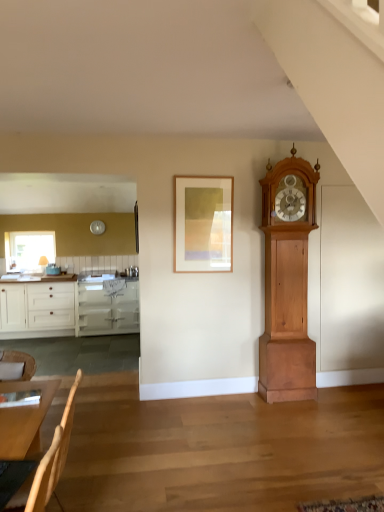
What do you see at coordinates (24, 420) in the screenshot? I see `light brown wooden table at lower left` at bounding box center [24, 420].

Find the location of a particular element. The image size is (384, 512). light brown wooden grandfather clock at right is located at coordinates (287, 282).

Considering the sizes of objects white glossy cabinetry at left and matte glass window at left in the image provided, who is smaller, white glossy cabinetry at left or matte glass window at left?

matte glass window at left.

How different are the orientations of white glossy cabinetry at left and matte glass window at left in degrees?

The angle between the facing direction of white glossy cabinetry at left and the facing direction of matte glass window at left is 0.483 degrees.

Is there a large distance between white glossy cabinetry at left and matte glass window at left?

Actually, white glossy cabinetry at left and matte glass window at left are a little close together.

From the image's perspective, which object appears higher, white glossy cabinetry at left or light brown wooden table at lower left?

light brown wooden table at lower left appears higher in the image.

How many degrees apart are the facing directions of white glossy cabinetry at left and light brown wooden table at lower left?

The facing directions of white glossy cabinetry at left and light brown wooden table at lower left are 86.7 degrees apart.

Can you see white glossy cabinetry at left touching light brown wooden table at lower left?

They are not placed beside each other.

Based on the photo, is wooden picture frame at center a part of white glossy cabinetry at left?

Definitely not — wooden picture frame at center is not inside white glossy cabinetry at left.

Is white glossy cabinetry at left aimed at wooden picture frame at center?

No, white glossy cabinetry at left is not aimed at wooden picture frame at center.

Considering the sizes of white glossy cabinetry at left and wooden picture frame at center in the image, is white glossy cabinetry at left wider or thinner than wooden picture frame at center?

Clearly, white glossy cabinetry at left has more width compared to wooden picture frame at center.

Can you confirm if light brown wooden grandfather clock at right is thinner than white glossy cabinetry at left?

Yes, light brown wooden grandfather clock at right is thinner than white glossy cabinetry at left.

From the image's perspective, between light brown wooden grandfather clock at right and white glossy cabinetry at left, who is located below?

white glossy cabinetry at left, from the image's perspective.

Is light brown wooden grandfather clock at right in front of or behind white glossy cabinetry at left in the image?

light brown wooden grandfather clock at right is positioned closer to the viewer than white glossy cabinetry at left.

From a real-world perspective, is light brown wooden grandfather clock at right positioned under white glossy cabinetry at left based on gravity?

No.

Is wooden picture frame at center far away from wooden chair at lower left?

Yes, wooden picture frame at center and wooden chair at lower left are located far from each other.

From a real-world perspective, which is physically above, wooden picture frame at center or wooden chair at lower left?

wooden picture frame at center, from a real-world perspective.

Image resolution: width=384 pixels, height=512 pixels. In order to click on chair located on the left of wooden picture frame at center in this screenshot , I will do `click(21, 361)`.

From the image's perspective, between wooden picture frame at center and wooden chair at lower left, which one is located above?

wooden picture frame at center appears higher in the image.

Which object is further away from the camera, white glossy cabinetry at left or wooden chair at lower left?

Positioned behind is white glossy cabinetry at left.

Considering the relative sizes of white glossy cabinetry at left and wooden chair at lower left in the image provided, is white glossy cabinetry at left wider than wooden chair at lower left?

Yes.

In the scene shown: Does white glossy cabinetry at left have a larger size compared to wooden chair at lower left?

Yes.

What's the angular difference between wooden chair at lower left and matte glass window at left's facing directions?

The angular difference between wooden chair at lower left and matte glass window at left is 18.1 degrees.

Is wooden chair at lower left taller than matte glass window at left?

No, wooden chair at lower left is not taller than matte glass window at left.

Would you say wooden chair at lower left contains matte glass window at left?

No, wooden chair at lower left does not contain matte glass window at left.

Is wooden chair at lower left wider than matte glass window at left?

Indeed, wooden chair at lower left has a greater width compared to matte glass window at left.

Where is `window located above the white glossy cabinetry at left (from a real-world perspective)`? This screenshot has width=384, height=512. window located above the white glossy cabinetry at left (from a real-world perspective) is located at coordinates (29, 250).

Image resolution: width=384 pixels, height=512 pixels. I want to click on cabinetry that is under the light brown wooden table at lower left (from a real-world perspective), so click(69, 308).

Considering their positions, is wooden chair at lower left positioned further to matte glass window at left than wooden picture frame at center?

wooden chair at lower left is further to matte glass window at left.

Considering their positions, is wooden picture frame at center positioned further to wooden chair at lower left than light brown wooden table at lower left?

The object further to wooden chair at lower left is wooden picture frame at center.

Based on their spatial positions, is light brown wooden table at lower left or white glossy cabinetry at left closer to wooden chair at lower left?

light brown wooden table at lower left.

From the image, which object appears to be nearer to light brown wooden grandfather clock at right, matte glass window at left or wooden picture frame at center?

wooden picture frame at center is closer to light brown wooden grandfather clock at right.

When comparing their distances from light brown wooden grandfather clock at right, does white glossy cabinetry at left or wooden picture frame at center seem further?

Result: white glossy cabinetry at left is positioned further to the anchor light brown wooden grandfather clock at right.

Which object lies nearer to the anchor point light brown wooden table at lower left, light wood armchair at lower left or white glossy cabinetry at left?

The object closer to light brown wooden table at lower left is light wood armchair at lower left.

Based on their spatial positions, is wooden picture frame at center or wooden chair at lower left closer to light wood armchair at lower left?

wooden chair at lower left is closer to light wood armchair at lower left.

Considering their positions, is wooden picture frame at center positioned further to white glossy cabinetry at left than light wood armchair at lower left?

light wood armchair at lower left is positioned further to the anchor white glossy cabinetry at left.

Identify the location of wall clock positioned between light wood armchair at lower left and wooden picture frame at center from near to far. (287, 282).

The height and width of the screenshot is (512, 384). Find the location of `chair between light brown wooden table at lower left and light brown wooden grandfather clock at right along the z-axis`. chair between light brown wooden table at lower left and light brown wooden grandfather clock at right along the z-axis is located at coordinates (21, 361).

Locate an element on the screen. cabinetry between wooden chair at lower left and matte glass window at left along the z-axis is located at coordinates (69, 308).

The image size is (384, 512). In order to click on cabinetry positioned between light brown wooden table at lower left and matte glass window at left from near to far in this screenshot , I will do `click(69, 308)`.